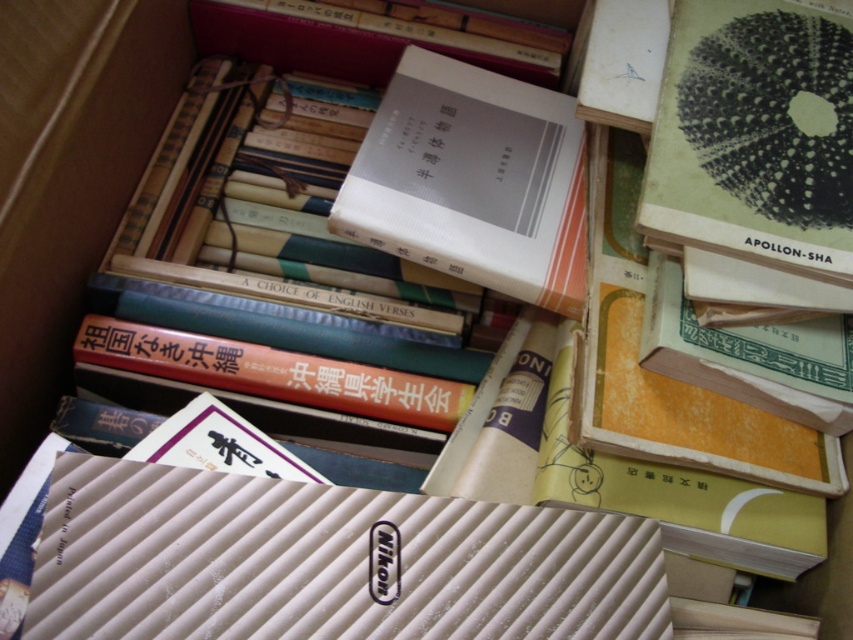
Based on the photo, can you confirm if white textured filter at lower left is positioned to the right of green matte book at upper right?

In fact, white textured filter at lower left is to the left of green matte book at upper right.

Does white textured filter at lower left appear over green matte book at upper right?

No, white textured filter at lower left is not above green matte book at upper right.

Which is in front, point (294, 492) or point (715, 218)?

Point (294, 492)

I want to click on white textured filter at lower left, so click(326, 563).

Consider the image. Who is positioned more to the right, white textured filter at lower left or white matte book at center?

white matte book at center is more to the right.

Is point (387, 627) positioned after point (410, 145)?

No, (387, 627) is in front of (410, 145).

Find the location of `white textured filter at lower left`. white textured filter at lower left is located at coordinates 326,563.

Who is lower down, green matte book at upper right or white matte book at center?

white matte book at center is below.

Is green matte book at upper right positioned at the back of white matte book at center?

No, it is not.

Does point (770, 198) come in front of point (549, 300)?

That is True.

Where is `green matte book at upper right`? green matte book at upper right is located at coordinates (755, 134).